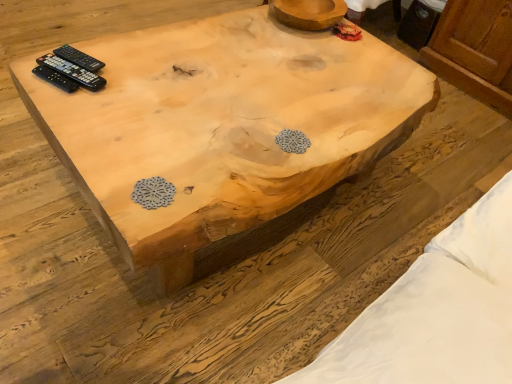
Question: Can you confirm if black plastic remote control at upper left, arranged as the 3th remote control when viewed from the front, is shorter than natural wood coffee table at center?

Choices:
 (A) no
 (B) yes

Answer: (B)

Question: Considering the relative positions of black plastic remote control at upper left, the first remote control positioned from the back, and natural wood coffee table at center in the image provided, is black plastic remote control at upper left, the first remote control positioned from the back, to the right of natural wood coffee table at center from the viewer's perspective?

Choices:
 (A) yes
 (B) no

Answer: (B)

Question: Is black plastic remote control at upper left, arranged as the 3th remote control when viewed from the front, looking in the opposite direction of natural wood coffee table at center?

Choices:
 (A) no
 (B) yes

Answer: (A)

Question: From a real-world perspective, is black plastic remote control at upper left, arranged as the 3th remote control when viewed from the front, beneath natural wood coffee table at center?

Choices:
 (A) no
 (B) yes

Answer: (A)

Question: Can natural wood coffee table at center be found inside black plastic remote control at upper left, arranged as the 3th remote control when viewed from the front?

Choices:
 (A) yes
 (B) no

Answer: (B)

Question: Is black plastic remote control at upper left, arranged as the 3th remote control when viewed from the front, positioned behind natural wood coffee table at center?

Choices:
 (A) yes
 (B) no

Answer: (A)

Question: Is natural wood coffee table at center to the left of black plastic remote controls at upper left, the second remote control from the back, from the viewer's perspective?

Choices:
 (A) yes
 (B) no

Answer: (B)

Question: Does natural wood coffee table at center lie behind black plastic remote controls at upper left, the second remote control when ordered from front to back?

Choices:
 (A) yes
 (B) no

Answer: (B)

Question: From a real-world perspective, is natural wood coffee table at center below black plastic remote controls at upper left, the second remote control from the back?

Choices:
 (A) no
 (B) yes

Answer: (B)

Question: From the image's perspective, is natural wood coffee table at center above black plastic remote controls at upper left, the second remote control from the back?

Choices:
 (A) no
 (B) yes

Answer: (A)

Question: Does natural wood coffee table at center have a lesser height compared to black plastic remote controls at upper left, the second remote control when ordered from front to back?

Choices:
 (A) yes
 (B) no

Answer: (B)

Question: Does natural wood coffee table at center turn towards black plastic remote controls at upper left, the second remote control when ordered from front to back?

Choices:
 (A) no
 (B) yes

Answer: (A)

Question: Considering the relative positions of black plastic remote at upper left, the 3th remote control when ordered from back to front, and black plastic remote control at upper left, arranged as the 3th remote control when viewed from the front, in the image provided, is black plastic remote at upper left, the 3th remote control when ordered from back to front, to the left of black plastic remote control at upper left, arranged as the 3th remote control when viewed from the front, from the viewer's perspective?

Choices:
 (A) yes
 (B) no

Answer: (A)